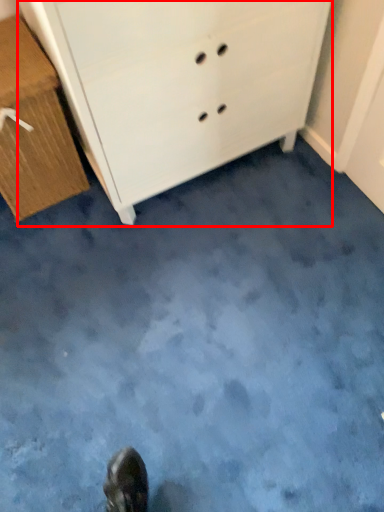
Question: Considering the relative positions of chest of drawers (annotated by the red box) and chest of drawers in the image provided, where is chest of drawers (annotated by the red box) located with respect to the staircase?

Choices:
 (A) right
 (B) left

Answer: (A)